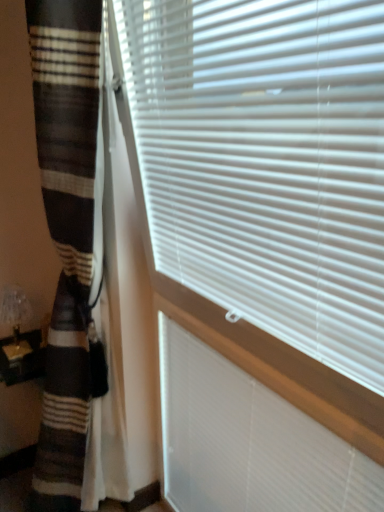
What is the approximate width of brown striped curtain at left?

32.37 centimeters.

Image resolution: width=384 pixels, height=512 pixels. Find the location of `striped wool blanket at left`. striped wool blanket at left is located at coordinates (64, 403).

This screenshot has height=512, width=384. Identify the location of translucent glass table lamp at lower left. (15, 320).

At what (x,y) coordinates should I click in order to perform the action: click on white plastic blinds at upper right. Please return your answer as a coordinate pair (x, y). The width and height of the screenshot is (384, 512). Looking at the image, I should click on (x=267, y=163).

From the image's perspective, between translucent glass table lamp at lower left and striped wool blanket at left, which one is located above?

From the image's view, translucent glass table lamp at lower left is above.

From a real-world perspective, relative to striped wool blanket at left, is translucent glass table lamp at lower left vertically above or below?

translucent glass table lamp at lower left is above striped wool blanket at left.

Looking at this image, which of these two, translucent glass table lamp at lower left or striped wool blanket at left, is bigger?

striped wool blanket at left is bigger.

Locate an element on the screen. table lamp behind the striped wool blanket at left is located at coordinates (15, 320).

From the image's perspective, who appears lower, white plastic blinds at upper right or white plastic blinds at center?

From the image's view, white plastic blinds at center is below.

Can you confirm if white plastic blinds at upper right is bigger than white plastic blinds at center?

Yes, white plastic blinds at upper right is bigger than white plastic blinds at center.

Which is in front, white plastic blinds at upper right or white plastic blinds at center?

white plastic blinds at upper right is more forward.

How distant is white plastic blinds at upper right from white plastic blinds at center?

white plastic blinds at upper right and white plastic blinds at center are 18.33 inches apart.

Which object is positioned more to the left, brown striped curtain at left or white plastic blinds at upper right?

Positioned to the left is brown striped curtain at left.

From the image's perspective, would you say brown striped curtain at left is positioned over white plastic blinds at upper right?

Incorrect, from the image's perspective, brown striped curtain at left is lower than white plastic blinds at upper right.

Which of these two, brown striped curtain at left or white plastic blinds at upper right, is wider?

brown striped curtain at left is wider.

Who is bigger, brown striped curtain at left or white plastic blinds at upper right?

brown striped curtain at left.

Is point (365, 497) in front of point (18, 333)?

Yes, it is.

Between white plastic blinds at center and translucent glass table lamp at lower left, which one has larger size?

Bigger between the two is white plastic blinds at center.

Is white plastic blinds at center in front of or behind translucent glass table lamp at lower left in the image?

white plastic blinds at center is in front of translucent glass table lamp at lower left.

Is striped wool blanket at left at the right side of brown striped curtain at left?

No, striped wool blanket at left is not to the right of brown striped curtain at left.

Is striped wool blanket at left closer to camera compared to brown striped curtain at left?

Yes, it is in front of brown striped curtain at left.

Is striped wool blanket at left facing away from brown striped curtain at left?

No, striped wool blanket at left's orientation is not away from brown striped curtain at left.

Is point (62, 376) less distant than point (43, 466)?

Yes, point (62, 376) is closer to viewer.

From the image's perspective, which object appears higher, white plastic blinds at upper right or striped wool blanket at left?

white plastic blinds at upper right, from the image's perspective.

Does white plastic blinds at upper right come behind striped wool blanket at left?

Yes, it is behind striped wool blanket at left.

In the scene shown: What's the angular difference between white plastic blinds at upper right and striped wool blanket at left's facing directions?

They differ by 90.4 degrees in their facing directions.

Can you confirm if white plastic blinds at upper right is smaller than striped wool blanket at left?

Correct, white plastic blinds at upper right occupies less space than striped wool blanket at left.

Is striped wool blanket at left next to translucent glass table lamp at lower left?

No, striped wool blanket at left is not touching translucent glass table lamp at lower left.

Can you tell me how much striped wool blanket at left and translucent glass table lamp at lower left differ in facing direction?

They differ by 0.966 degrees in their facing directions.

Does point (72, 315) appear closer or farther from the camera than point (23, 352)?

Point (72, 315).

I want to click on table lamp above the striped wool blanket at left (from a real-world perspective), so [15, 320].

At what (x,y) coordinates should I click in order to perform the action: click on window blind above the white plastic blinds at center (from the image's perspective). Please return your answer as a coordinate pair (x, y). The width and height of the screenshot is (384, 512). Looking at the image, I should click on (267, 163).

Looking at the image, which one is located further to brown striped curtain at left, white plastic blinds at upper right or striped wool blanket at left?

Based on the image, white plastic blinds at upper right appears to be further to brown striped curtain at left.

Estimate the real-world distances between objects in this image. Which object is further from white plastic blinds at center, white plastic blinds at upper right or striped wool blanket at left?

white plastic blinds at upper right lies further to white plastic blinds at center than the other object.

From the image, which object appears to be nearer to white plastic blinds at upper right, striped wool blanket at left or brown striped curtain at left?

Based on the image, brown striped curtain at left appears to be nearer to white plastic blinds at upper right.

Which object lies further to the anchor point translucent glass table lamp at lower left, white plastic blinds at center or brown striped curtain at left?

white plastic blinds at center is positioned further to the anchor translucent glass table lamp at lower left.

Estimate the real-world distances between objects in this image. Which object is closer to white plastic blinds at upper right, white plastic blinds at center or brown striped curtain at left?

The object closer to white plastic blinds at upper right is white plastic blinds at center.

From the image, which object appears to be nearer to white plastic blinds at center, brown striped curtain at left or striped wool blanket at left?

striped wool blanket at left is closer to white plastic blinds at center.

From the image, which object appears to be farther from white plastic blinds at center, white plastic blinds at upper right or brown striped curtain at left?

brown striped curtain at left is further to white plastic blinds at center.

Consider the image. Which object lies further to the anchor point white plastic blinds at center, translucent glass table lamp at lower left or striped wool blanket at left?

The object further to white plastic blinds at center is translucent glass table lamp at lower left.

Locate an element on the screen. This screenshot has width=384, height=512. curtain between striped wool blanket at left and translucent glass table lamp at lower left along the z-axis is located at coordinates (66, 231).

Where is `curtain between white plastic blinds at upper right and striped wool blanket at left from top to bottom`? curtain between white plastic blinds at upper right and striped wool blanket at left from top to bottom is located at coordinates (66, 231).

Image resolution: width=384 pixels, height=512 pixels. Find the location of `blind positioned between white plastic blinds at upper right and translucent glass table lamp at lower left from near to far`. blind positioned between white plastic blinds at upper right and translucent glass table lamp at lower left from near to far is located at coordinates (249, 441).

The height and width of the screenshot is (512, 384). I want to click on curtain located between striped wool blanket at left and white plastic blinds at center in the left-right direction, so click(66, 231).